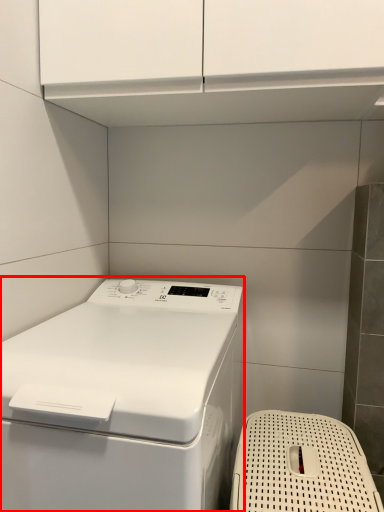
Question: From the image's perspective, what is the correct spatial relationship of home appliance (annotated by the red box) in relation to dish washer?

Choices:
 (A) below
 (B) above

Answer: (B)